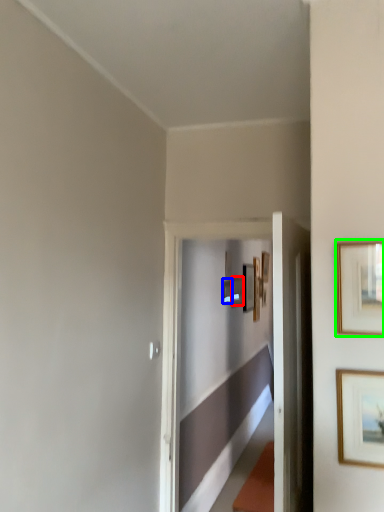
Question: Which object is positioned closest to picture frame (highlighted by a red box)? Select from picture frame (highlighted by a blue box) and picture frame (highlighted by a green box).

Choices:
 (A) picture frame
 (B) picture frame

Answer: (A)